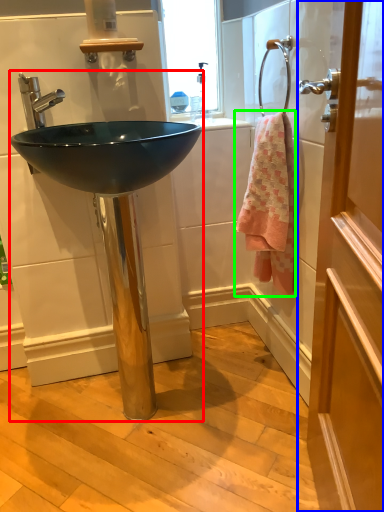
Question: Based on their relative distances, which object is farther from sink (highlighted by a red box)? Choose from door (highlighted by a blue box) and towel/napkin (highlighted by a green box).

Choices:
 (A) door
 (B) towel/napkin

Answer: (A)